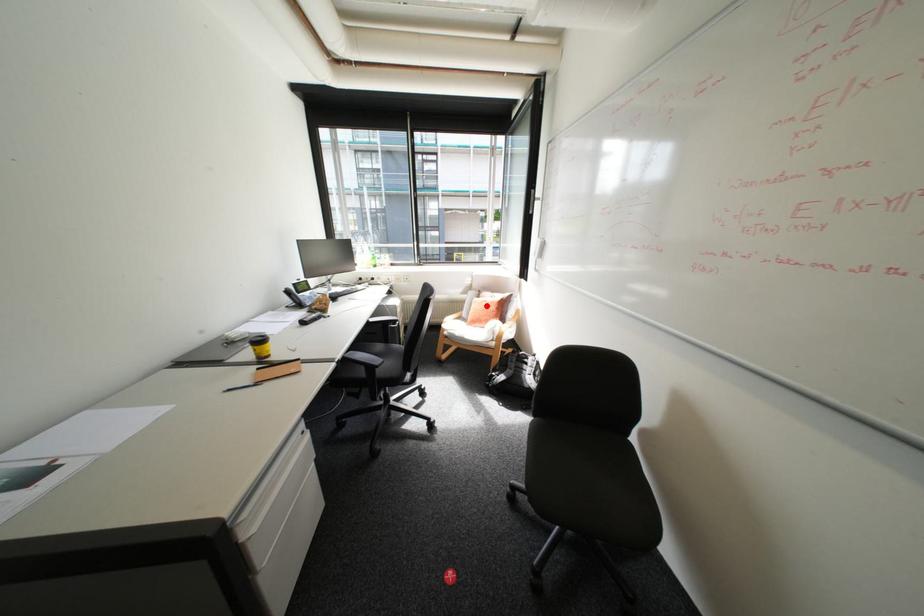
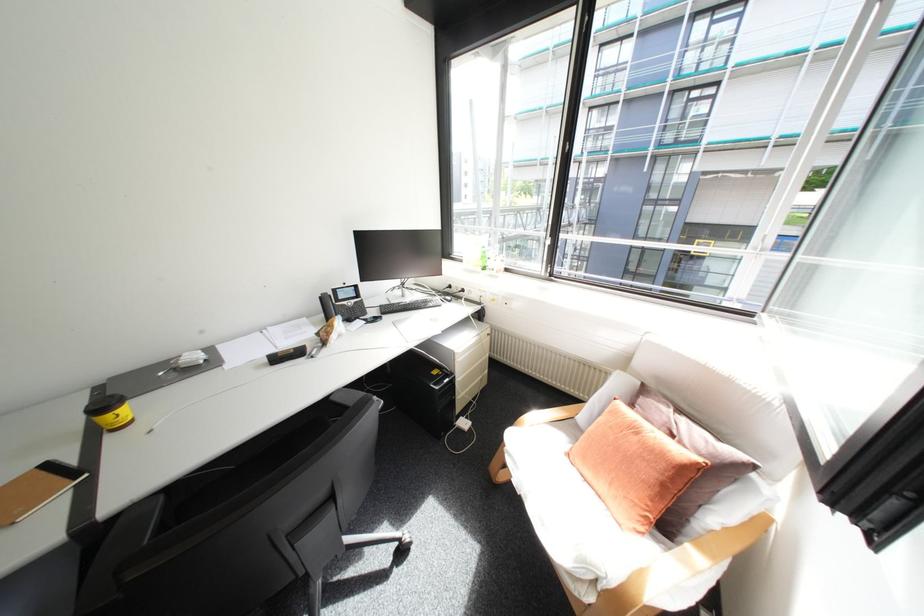
Question: I am providing you with two images of the same scene from different viewpoints. A red point is shown in image1. For the corresponding object point in image2, is it positioned nearer or farther from the camera?

Choices:
 (A) Nearer
 (B) Farther

Answer: (A)